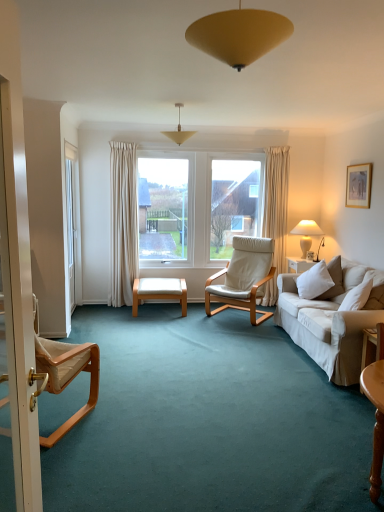
Question: In which direction should I rotate to look at white leather chair at center, which is the 1th chair from right to left?

Choices:
 (A) left
 (B) right

Answer: (B)

Question: Are white leather chair at center, the second chair when ordered from left to right, and white glass screen door at left, marked as the 1th screen door in a left-to-right arrangement, far apart?

Choices:
 (A) yes
 (B) no

Answer: (A)

Question: Does white leather chair at center, the first chair when ordered from back to front, lie behind white glass screen door at left, which is the first screen door in back-to-front order?

Choices:
 (A) no
 (B) yes

Answer: (B)

Question: From a real-world perspective, is white leather chair at center, the first chair when ordered from back to front, physically above white glass screen door at left, which appears as the 2th screen door when viewed from the front?

Choices:
 (A) yes
 (B) no

Answer: (B)

Question: From the image's perspective, would you say white leather chair at center, which is the 1th chair from right to left, is positioned over white glass screen door at left, the 2th screen door from the right?

Choices:
 (A) no
 (B) yes

Answer: (A)

Question: Considering the relative sizes of white leather chair at center, the second chair when ordered from left to right, and white glass screen door at left, the 2th screen door from the right, in the image provided, is white leather chair at center, the second chair when ordered from left to right, smaller than white glass screen door at left, the 2th screen door from the right,?

Choices:
 (A) yes
 (B) no

Answer: (B)

Question: Considering the relative sizes of white leather chair at center, the first chair when ordered from back to front, and white glass screen door at left, the 2th screen door from the right, in the image provided, is white leather chair at center, the first chair when ordered from back to front, shorter than white glass screen door at left, the 2th screen door from the right,?

Choices:
 (A) no
 (B) yes

Answer: (B)

Question: Is white soft cushion at right closer to camera compared to white leather chair at center, the first chair when ordered from back to front?

Choices:
 (A) yes
 (B) no

Answer: (A)

Question: From a real-world perspective, does white soft cushion at right stand above white leather chair at center, which is the 1th chair from right to left?

Choices:
 (A) no
 (B) yes

Answer: (B)

Question: Considering the relative positions of white soft cushion at right and white leather chair at center, the second chair when ordered from left to right, in the image provided, is white soft cushion at right to the left of white leather chair at center, the second chair when ordered from left to right, from the viewer's perspective?

Choices:
 (A) no
 (B) yes

Answer: (A)

Question: Considering the relative sizes of white soft cushion at right and white leather chair at center, which is counted as the second chair, starting from the front, in the image provided, is white soft cushion at right smaller than white leather chair at center, which is counted as the second chair, starting from the front,?

Choices:
 (A) no
 (B) yes

Answer: (B)

Question: Does white soft cushion at right have a lesser width compared to white leather chair at center, which is the 1th chair from right to left?

Choices:
 (A) yes
 (B) no

Answer: (A)

Question: Considering the relative sizes of white soft cushion at right and white leather chair at center, the second chair when ordered from left to right, in the image provided, is white soft cushion at right shorter than white leather chair at center, the second chair when ordered from left to right,?

Choices:
 (A) no
 (B) yes

Answer: (B)

Question: From a real-world perspective, is white ceramic lamp at right, placed as the first lamp when sorted from bottom to top, located beneath white soft cushion at right?

Choices:
 (A) no
 (B) yes

Answer: (A)